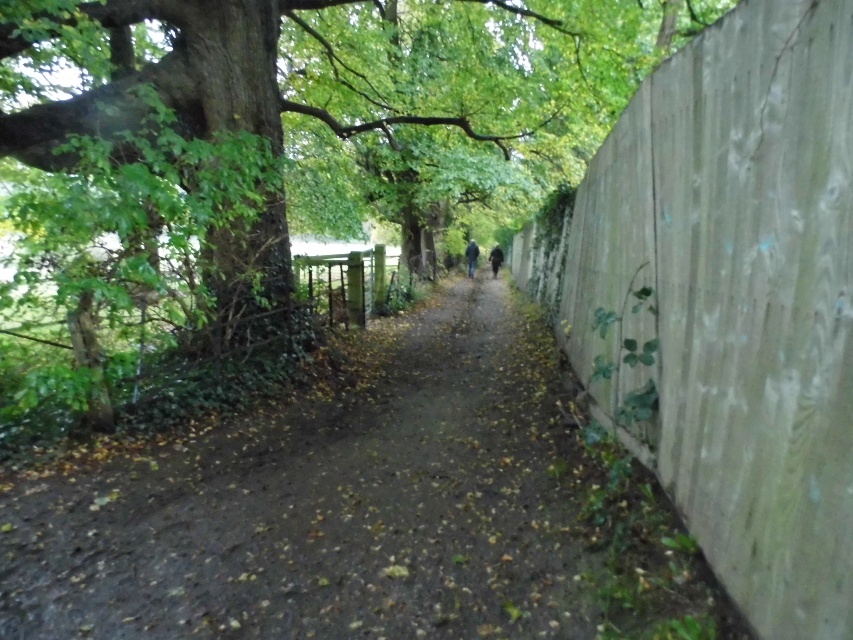
Question: Which of the following is the farthest from the observer?

Choices:
 (A) (474, 252)
 (B) (498, 252)
 (C) (509, 138)

Answer: (B)

Question: Where is dark blue fabric at center located in relation to dark gray jacket at center in the image?

Choices:
 (A) left
 (B) right

Answer: (A)

Question: Is dark blue fabric at center bigger than dark gray jacket at center?

Choices:
 (A) no
 (B) yes

Answer: (A)

Question: Which object appears farthest from the camera in this image?

Choices:
 (A) dark gray jacket at center
 (B) dark blue fabric at center

Answer: (A)

Question: Can you confirm if dark blue fabric at center is positioned to the right of dark gray jacket at center?

Choices:
 (A) yes
 (B) no

Answer: (B)

Question: Among these points, which one is farthest from the camera?

Choices:
 (A) (474, 256)
 (B) (496, 260)
 (C) (73, 291)

Answer: (B)